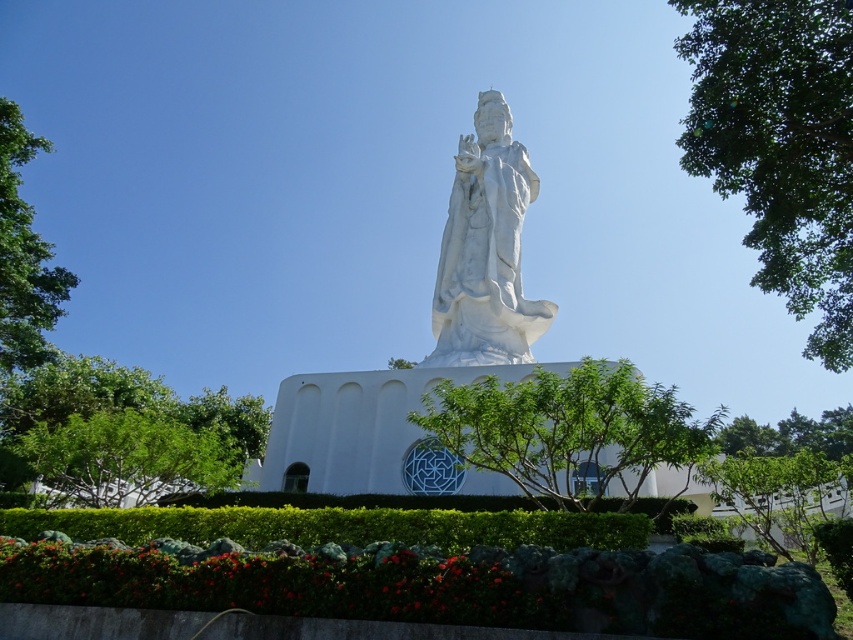
You are standing in front of the statue and want to take a photo that includes the green leafy tree at upper right. Where should you position yourself to ensure the tree is in the frame?

Position yourself so that the green leafy tree at upper right is within the camera view centered around the coordinates 0.228 on the x and 0.916 on the y axis.

Consider the image. You are standing in front of the statue and want to take a photo that includes both the statue and the green leafy tree at upper right. Which direction should you face to ensure both are in the frame?

You should face towards the upper right direction to include both the statue and the green leafy tree at upper right in your photo, as the tree is located at point (780, 145) relative to the image.